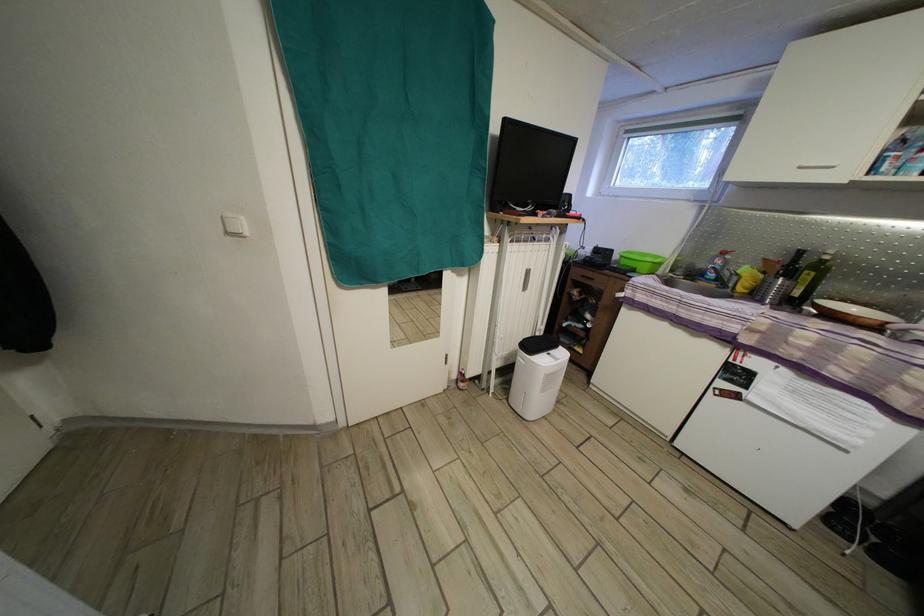
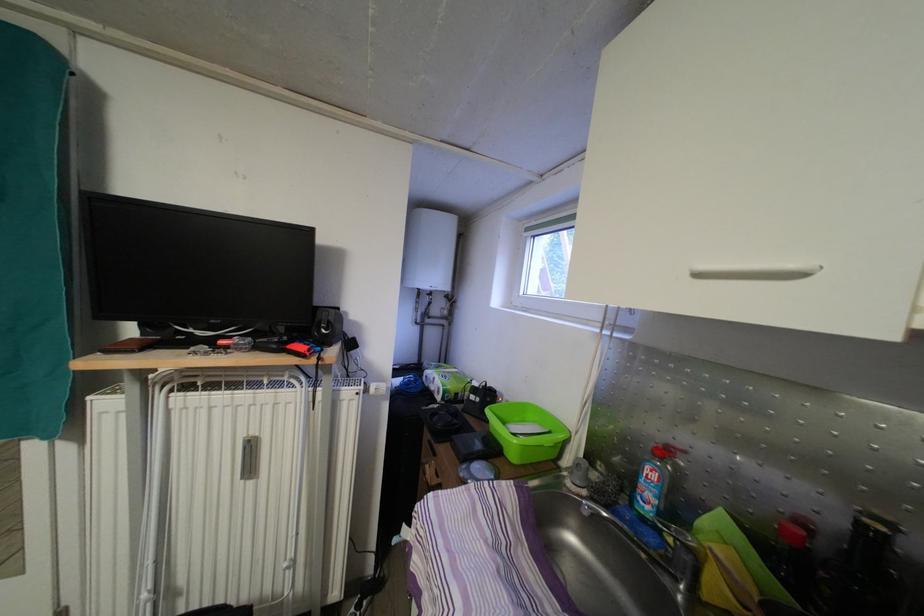
Question: I am providing you with two images of the same scene from different viewpoints. After the viewpoint changes to image2, which objects are now occluded?

Choices:
 (A) white radiator knob
 (B) red nintendo joy-con
 (C) silver faucet handle
 (D) none of these

Answer: (D)